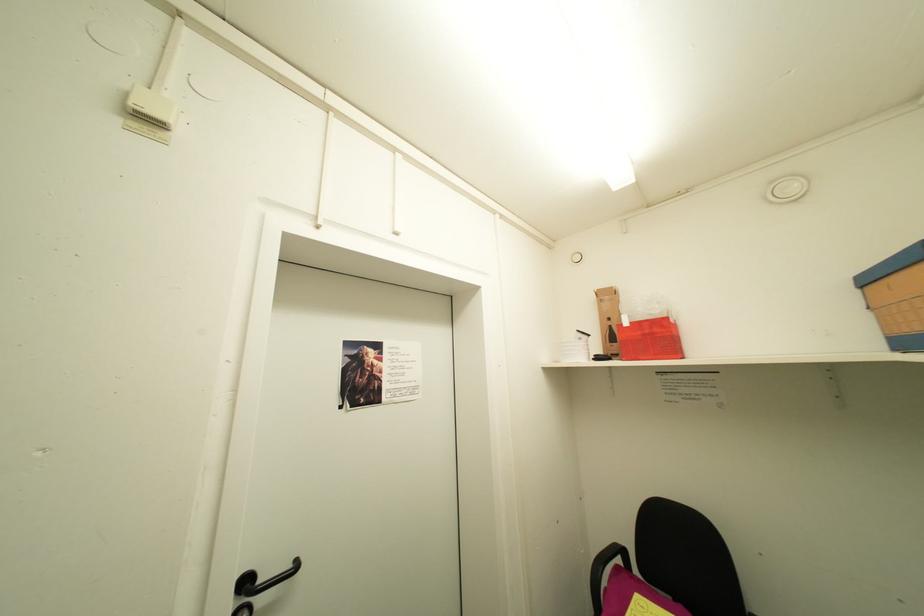
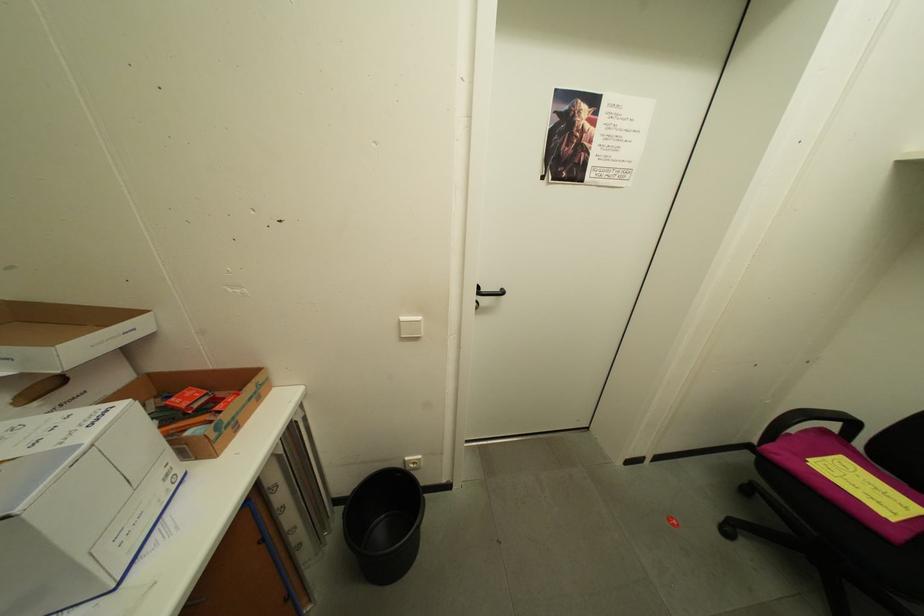
First-person continuous shooting, in which direction is the camera rotating?

The rotation direction of the camera is left-down.